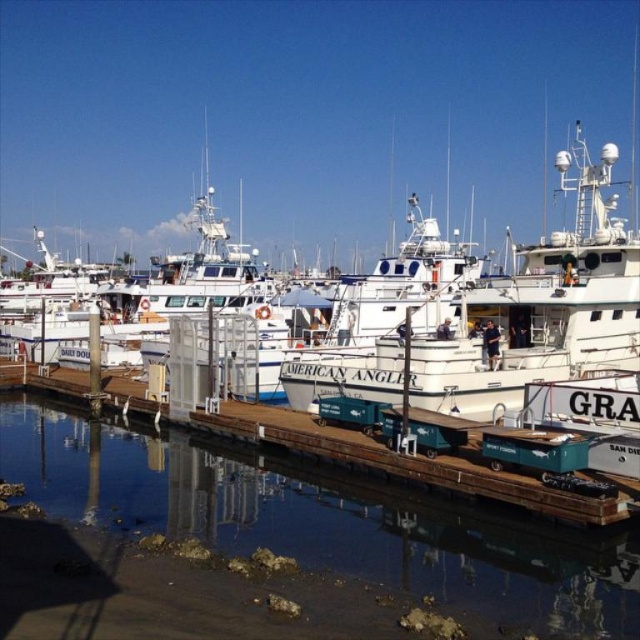
Is clear water at dock center taller than white matte boat at center?

No, clear water at dock center is not taller than white matte boat at center.

Between clear water at dock center and white matte boat at center, which one has more height?

white matte boat at center is taller.

Does point (144, 445) lie behind point (596, 344)?

No, it is in front of (596, 344).

Find the location of `clear water at dock center`. clear water at dock center is located at coordinates (324, 518).